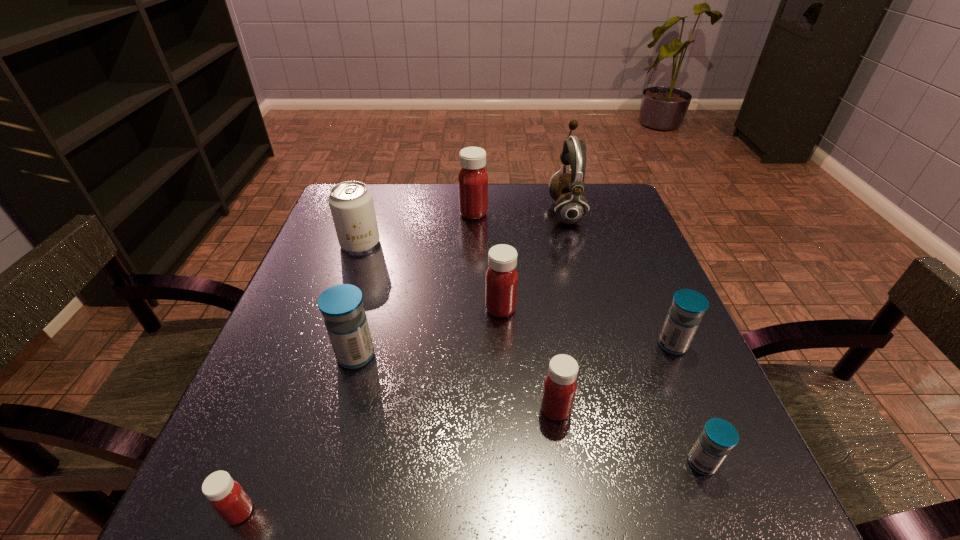
Find the location of `the third object from right to left`. the third object from right to left is located at coordinates point(566,189).

You are a GUI agent. You are given a task and a screenshot of the screen. Output one action in this format:
    pyautogui.click(x=<x>, y=<y>)
    Task: Click on the earphone
    The height and width of the screenshot is (540, 960).
    Given the screenshot: What is the action you would take?
    pyautogui.click(x=566, y=189)

This screenshot has height=540, width=960. In order to click on the farthest red medicine in this screenshot , I will do `click(472, 180)`.

I want to click on the eighth shortest object, so click(x=472, y=180).

Locate an element on the screen. soda can is located at coordinates (351, 203).

At what (x,y) coordinates should I click in order to perform the action: click on the leftmost blue medicine. Please return your answer as a coordinate pair (x, y). Looking at the image, I should click on click(341, 305).

This screenshot has width=960, height=540. In order to click on the biggest blue medicine in this screenshot , I will do `click(341, 305)`.

Image resolution: width=960 pixels, height=540 pixels. Find the location of `the second farthest red medicine`. the second farthest red medicine is located at coordinates (501, 277).

This screenshot has height=540, width=960. I want to click on the third smallest red medicine, so click(501, 277).

This screenshot has height=540, width=960. Identify the location of the second smallest blue medicine. (688, 306).